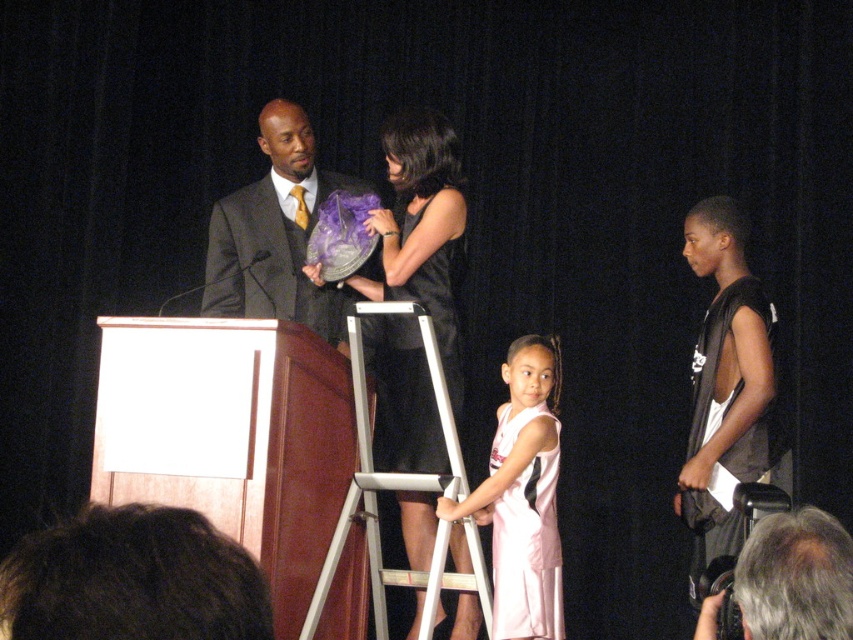
You are an event photographer positioned at the back of the stage. You need to capture a photo that includes both the dark brown hair at lower left and the matte black suit at center. Based on their positions, which object should you adjust your camera focus to first to ensure both are in frame?

Since the dark brown hair at lower left is to the right of the matte black suit at center, you should first focus on the matte black suit at center, as it is closer to the center of the frame, and then adjust the camera to include the dark brown hair at lower left to the right of it.

You are an event planner observing the stage setup. You need to ensure that the matte black suit at center and the gray hair at lower right are visible to the audience. Considering their heights, which one might need a raised platform to be seen clearly?

The gray hair at lower right might need a raised platform because it is shorter than the matte black suit at center, which is taller and could block its view.

You are an event planner trying to arrange seating for guests. You need to know the relative sizes of the black satin dress at center and the gray hair at lower right to ensure comfortable spacing. Which object is wider?

The black satin dress at center is wider than the gray hair at lower right according to the description.